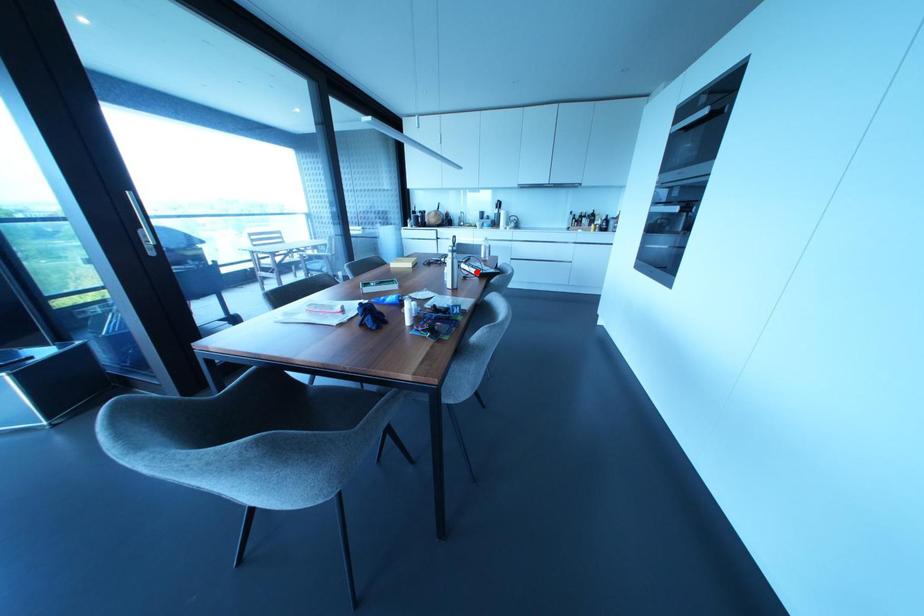
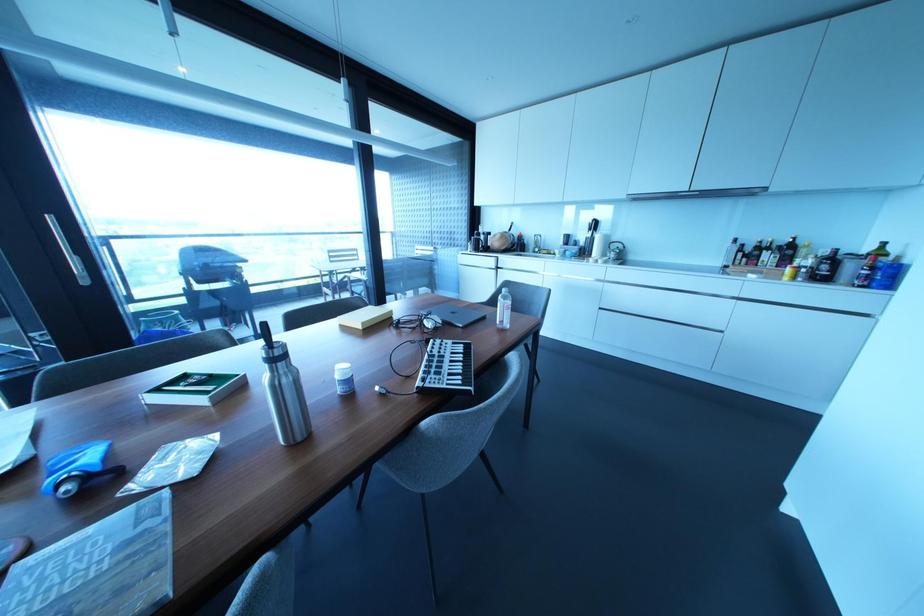
Question: I am providing you with two images of the same scene from different viewpoints. A red point is marked on the first image. Can you still see the location of the red point in image 2?

Choices:
 (A) Yes
 (B) No

Answer: (A)